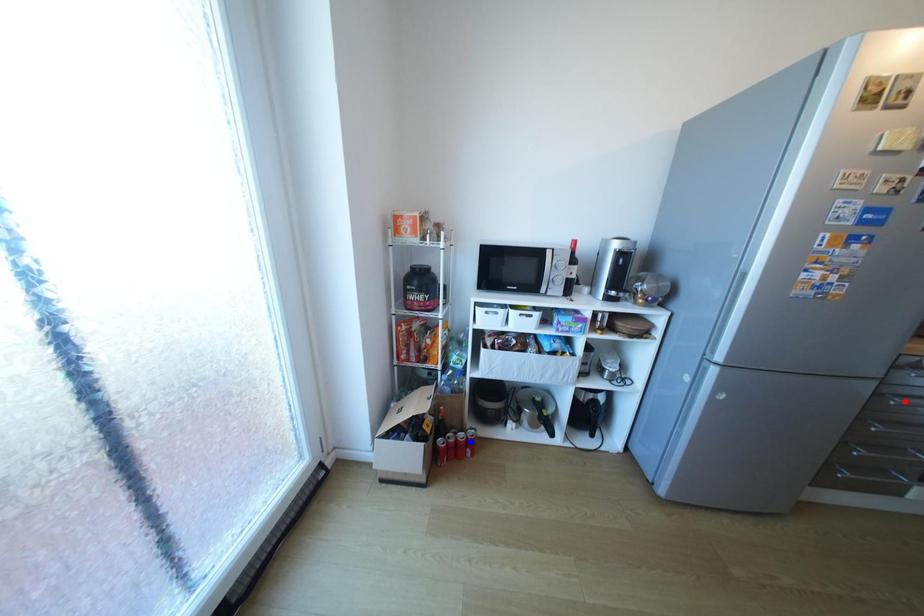
Question: In the image, two points are highlighted. Which point is nearer to the camera? Reply with the corresponding letter.

Choices:
 (A) blue point
 (B) red point

Answer: (B)